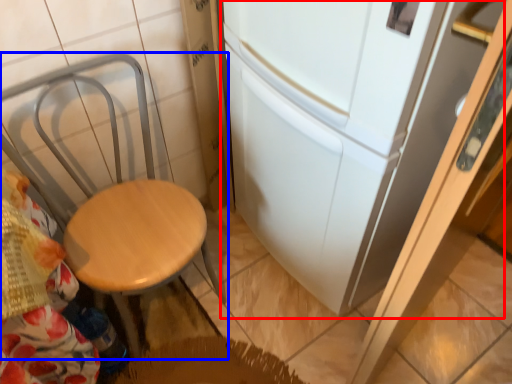
Question: Which of the following is the farthest to the observer, fridge (highlighted by a red box) or chair (highlighted by a blue box)?

Choices:
 (A) fridge
 (B) chair

Answer: (B)